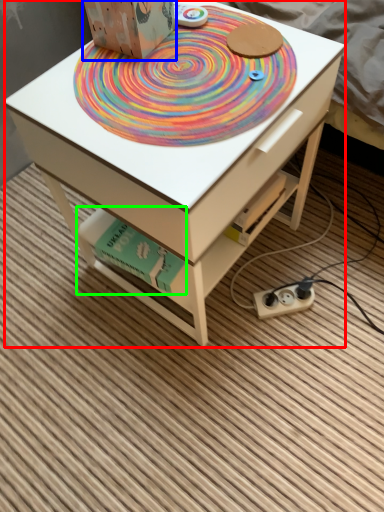
Question: Which is nearer to the table (highlighted by a red box)? cardboard box (highlighted by a blue box) or book (highlighted by a green box).

Choices:
 (A) cardboard box
 (B) book

Answer: (B)